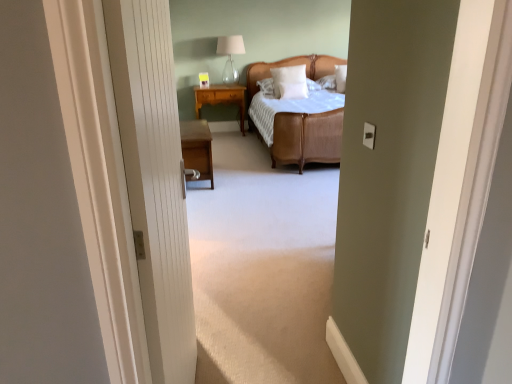
Question: Is wooden nightstand at left, which is counted as the second nightstand, starting from the top, to the left or to the right of white soft pillow at center, placed as the first pillow when sorted from top to bottom, in the image?

Choices:
 (A) left
 (B) right

Answer: (A)

Question: In terms of height, does wooden nightstand at left, which is counted as the second nightstand, starting from the top, look taller or shorter compared to white soft pillow at center, which is counted as the second pillow, starting from the bottom?

Choices:
 (A) tall
 (B) short

Answer: (B)

Question: Which object is positioned closest to the woven rattan bed at center?

Choices:
 (A) wooden nightstand at left, which appears as the second nightstand when viewed from the back
 (B) matte glass table lamp at upper center
 (C) white soft pillow at center, the first pillow ordered from the bottom
 (D) white soft pillow at center, which is counted as the second pillow, starting from the bottom
 (E) white textured door at center

Answer: (C)

Question: Estimate the real-world distances between objects in this image. Which object is farther from the light brown wood nightstand at center, which is counted as the second nightstand, starting from the bottom?

Choices:
 (A) white soft pillow at center, placed as the first pillow when sorted from top to bottom
 (B) white soft pillow at center, the 2th pillow from the top
 (C) wooden nightstand at left, which is counted as the second nightstand, starting from the top
 (D) woven rattan bed at center
 (E) white textured door at center

Answer: (E)